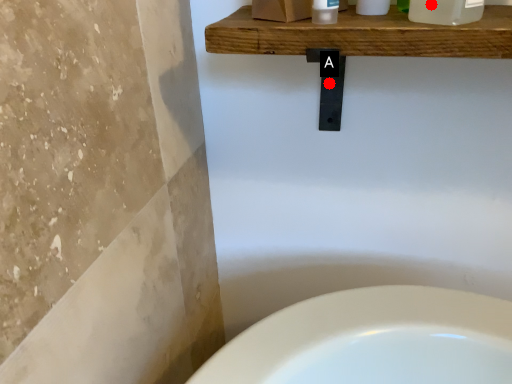
Question: Two points are circled on the image, labeled by A and B beside each circle. Which point appears farthest from the camera in this image?

Choices:
 (A) A is further
 (B) B is further

Answer: (A)